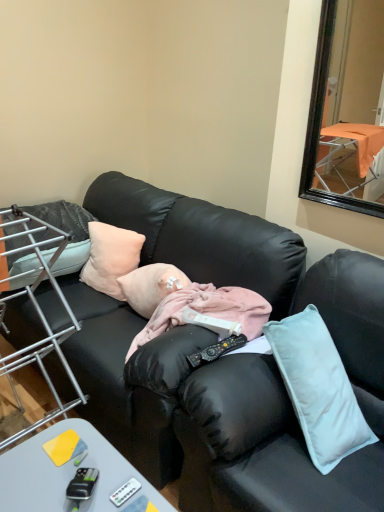
I want to click on vacant space situated above gray plastic desk at lower left (from a real-world perspective), so click(74, 472).